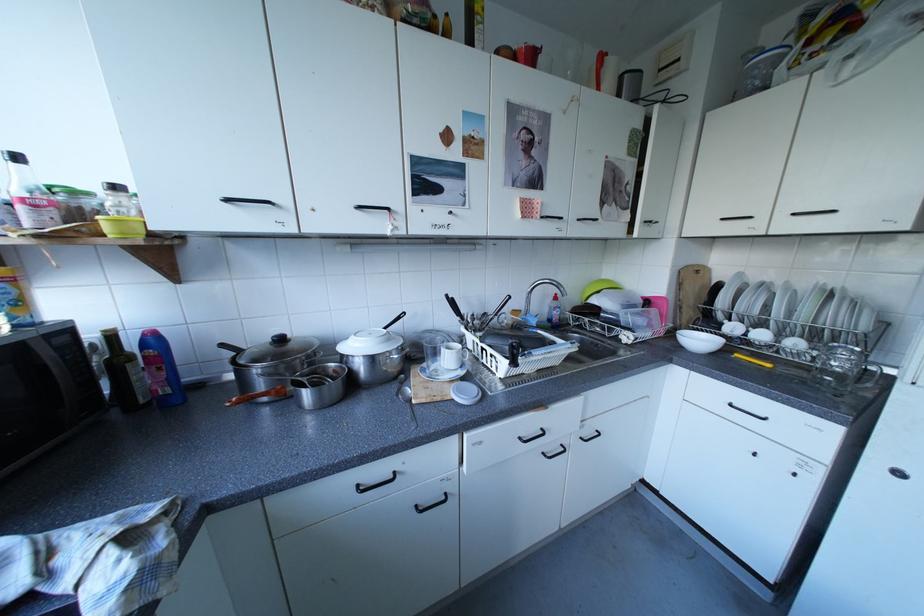
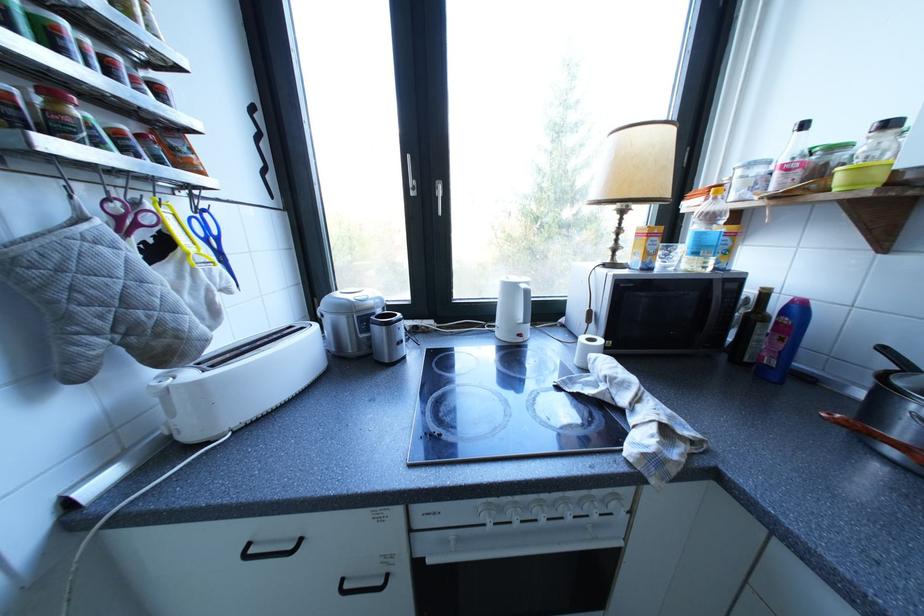
Find the pixel in the second image that matches point (156, 346) in the first image.

(797, 312)